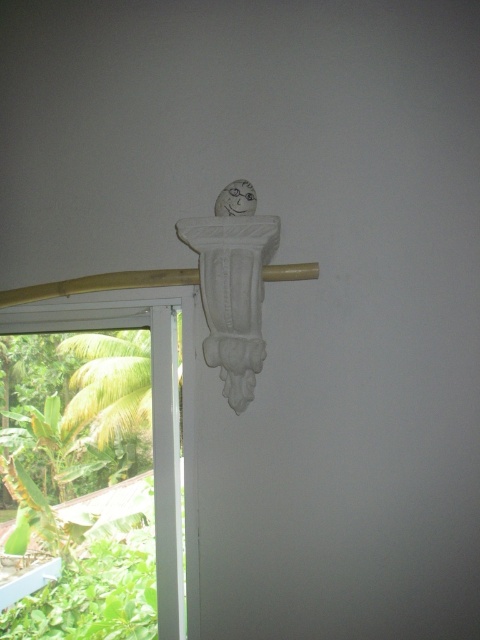
Does transparent glass window at left have a greater height compared to white wood beam at upper center?

Yes, transparent glass window at left is taller than white wood beam at upper center.

Between transparent glass window at left and white wood beam at upper center, which one appears on the right side from the viewer's perspective?

From the viewer's perspective, white wood beam at upper center appears more on the right side.

Which is behind, point (113, 467) or point (312, 268)?

Point (113, 467)

This screenshot has width=480, height=640. Find the location of `transparent glass window at left`. transparent glass window at left is located at coordinates (96, 460).